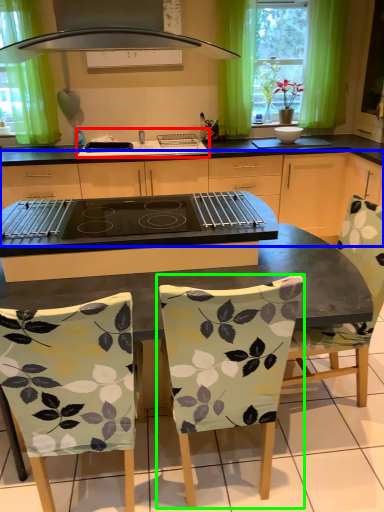
Question: Estimate the real-world distances between objects in this image. Which object is closer to sink (highlighted by a red box), cabinetry (highlighted by a blue box) or chair (highlighted by a green box)?

Choices:
 (A) cabinetry
 (B) chair

Answer: (A)